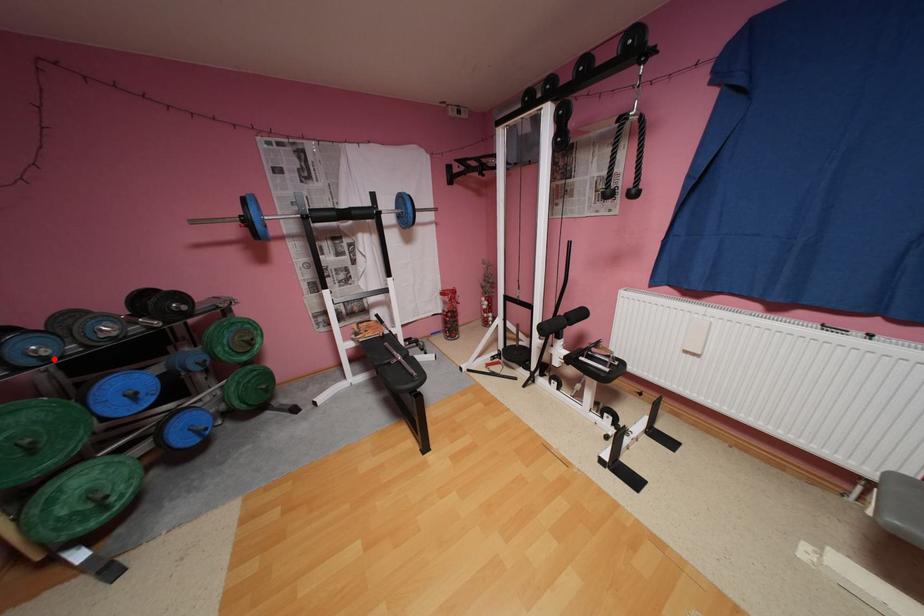
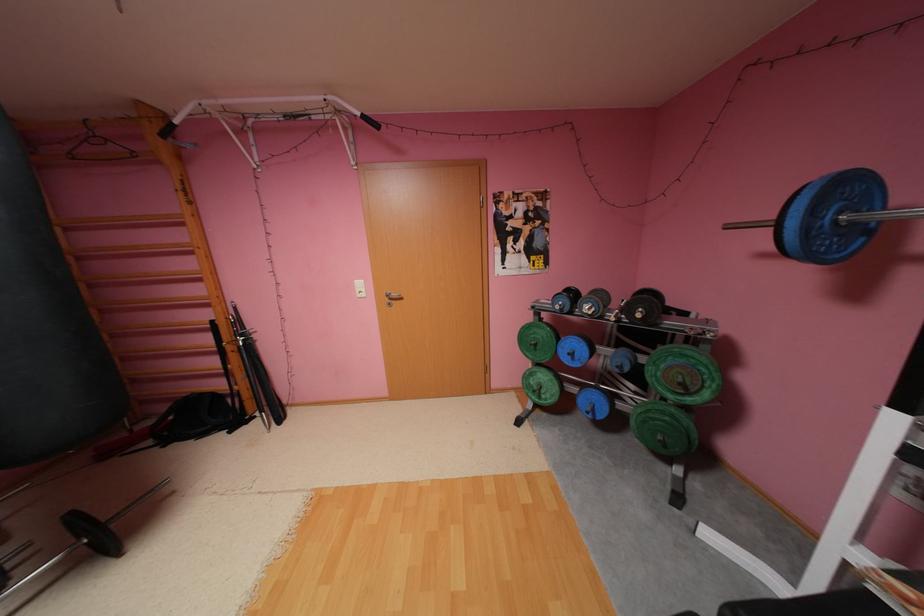
Question: A red point is marked in image1. In image2, is the corresponding 3D point closer to the camera or farther? Reply with the corresponding letter.

Choices:
 (A) The corresponding 3D point is closer.
 (B) The corresponding 3D point is farther.

Answer: (A)